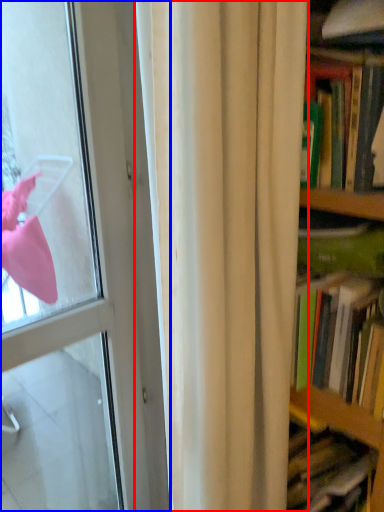
Question: Which point is closer to the camera, curtain (highlighted by a red box) or door (highlighted by a blue box)?

Choices:
 (A) curtain
 (B) door

Answer: (A)